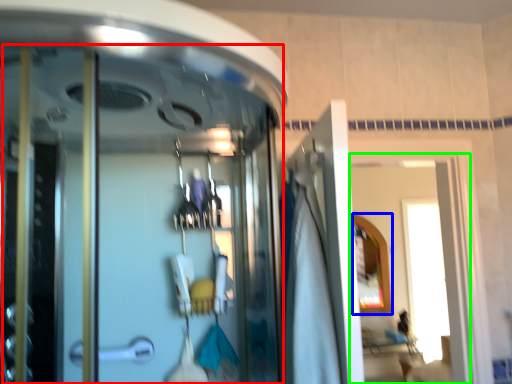
Question: Estimate the real-world distances between objects in this image. Which object is closer to screen door (highlighted by a red box), mirror (highlighted by a blue box) or window (highlighted by a green box)?

Choices:
 (A) mirror
 (B) window

Answer: (A)